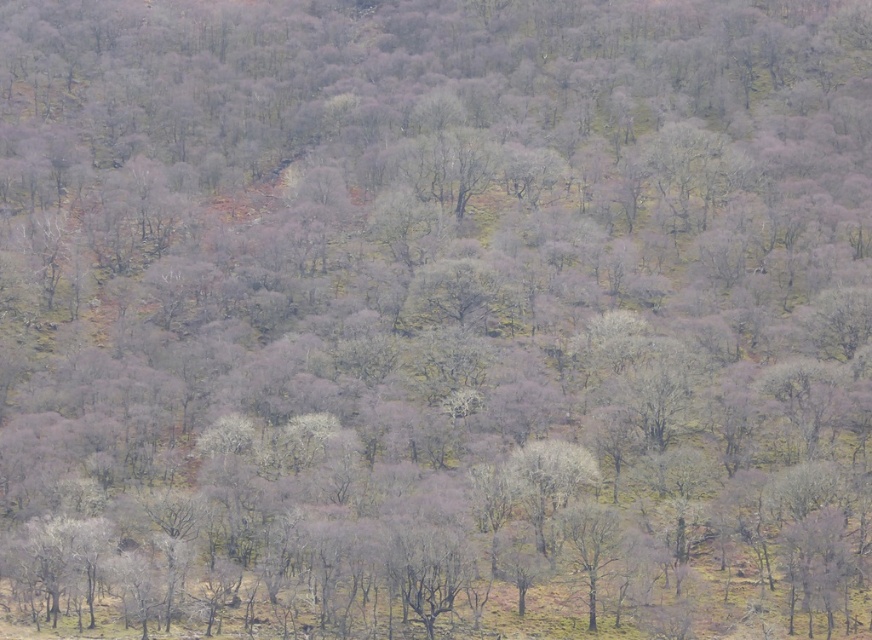
Is point (532, 444) behind point (570, 540)?

That is True.

Between smooth gray tree at center and smooth bark tree at center, which one appears on the right side from the viewer's perspective?

smooth bark tree at center

The width and height of the screenshot is (872, 640). What do you see at coordinates (547, 481) in the screenshot?
I see `smooth gray tree at center` at bounding box center [547, 481].

What are the coordinates of `smooth gray tree at center` in the screenshot? It's located at point(547,481).